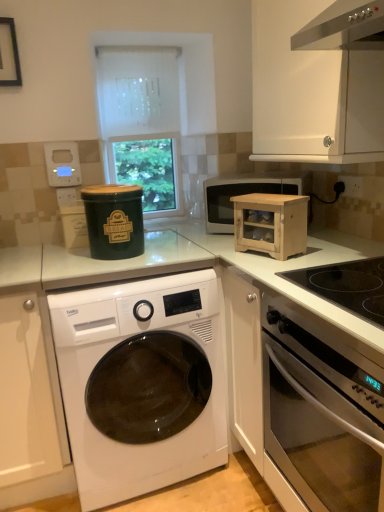
Question: Considering their positions, is natural wood cabinet at right located in front of or behind green matte canister at center, placed as the 2th appliance when sorted from back to front?

Choices:
 (A) front
 (B) behind

Answer: (A)

Question: Does point (256, 229) appear closer or farther from the camera than point (109, 245)?

Choices:
 (A) farther
 (B) closer

Answer: (B)

Question: Based on their relative distances, which object is nearer to the black glass cooktop at right?

Choices:
 (A) natural wood cabinet at right
 (B) matte black microwave at center
 (C) white glossy washing machine at center
 (D) white textured roller blind at upper center
 (E) white matte cabinet at lower left, the 2th cabinetry when ordered from right to left

Answer: (A)

Question: Estimate the real-world distances between objects in this image. Which object is closer to the matte black microwave at center?

Choices:
 (A) black matte picture frame at upper left
 (B) white matte cabinet at lower left, which is the 1th cabinetry from left to right
 (C) black glass cooktop at right
 (D) white matte cabinet at upper right, positioned as the 2th cabinetry in left-to-right order
 (E) white textured roller blind at upper center

Answer: (D)